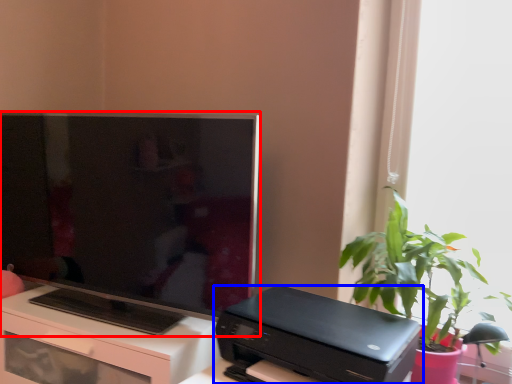
Question: Which object is closer to the camera taking this photo, television (highlighted by a red box) or printer (highlighted by a blue box)?

Choices:
 (A) television
 (B) printer

Answer: (B)